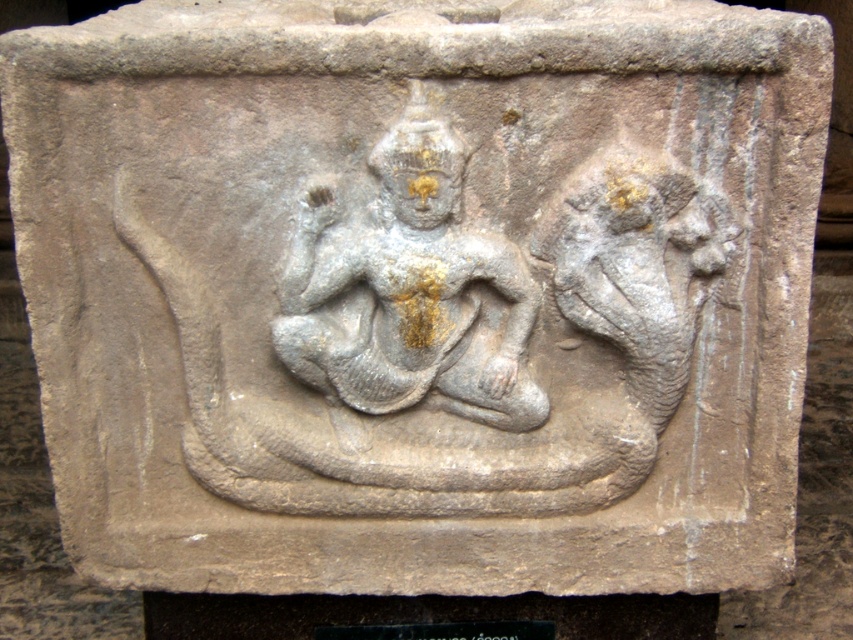
Is gray stone carving at center smaller than gray stone deity at center?

No.

Can you confirm if gray stone carving at center is positioned above gray stone deity at center?

No, gray stone carving at center is not above gray stone deity at center.

Between point (505, 337) and point (477, 321), which one is positioned in front?

Point (477, 321) is in front.

Where is `gray stone carving at center`? The height and width of the screenshot is (640, 853). gray stone carving at center is located at coordinates (438, 321).